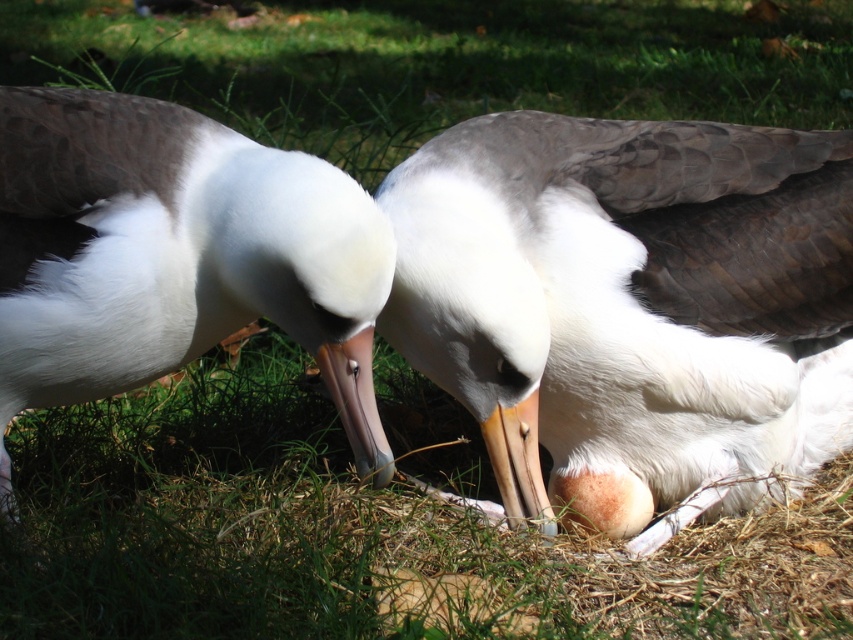
Is white fluffy feathers at center wider than white matte mollymawk at center?

Yes, white fluffy feathers at center is wider than white matte mollymawk at center.

Is point (595, 344) farther from camera compared to point (136, 275)?

Yes, point (595, 344) is behind point (136, 275).

Is point (752, 262) positioned before point (48, 106)?

No.

Locate an element on the screen. white fluffy feathers at center is located at coordinates (631, 308).